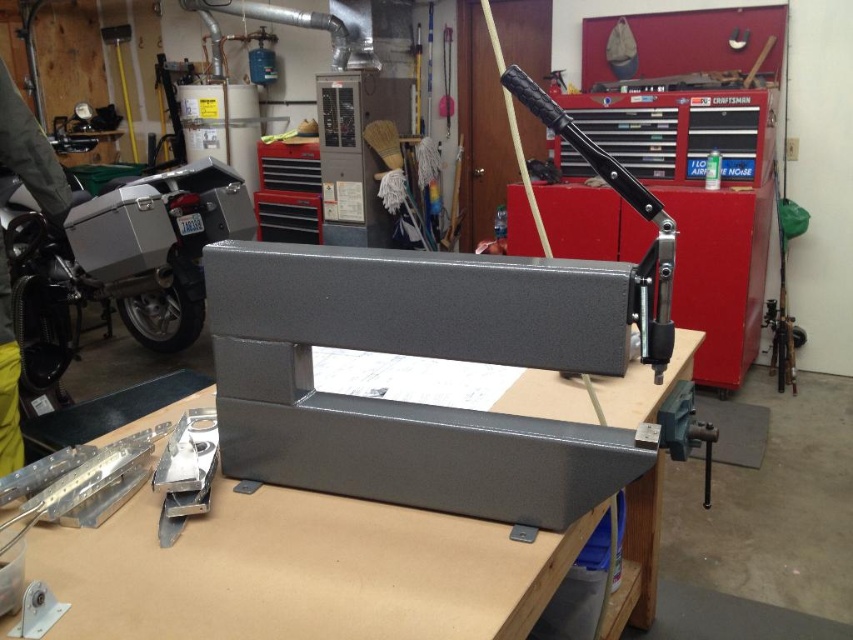
You are a mechanic who needs to assess the height of the brushed metal motorcycle at left and the matte black handle at upper center. Which object is taller?

The brushed metal motorcycle at left is much taller than the matte black handle at upper center.

You are standing in the workshop and want to reach both the point at coordinates point (67, 344) and the point at coordinates point (581, 156). Which point is closer to you?

Point point (67, 344) is closer to you because it is further to the camera than point point (581, 156).